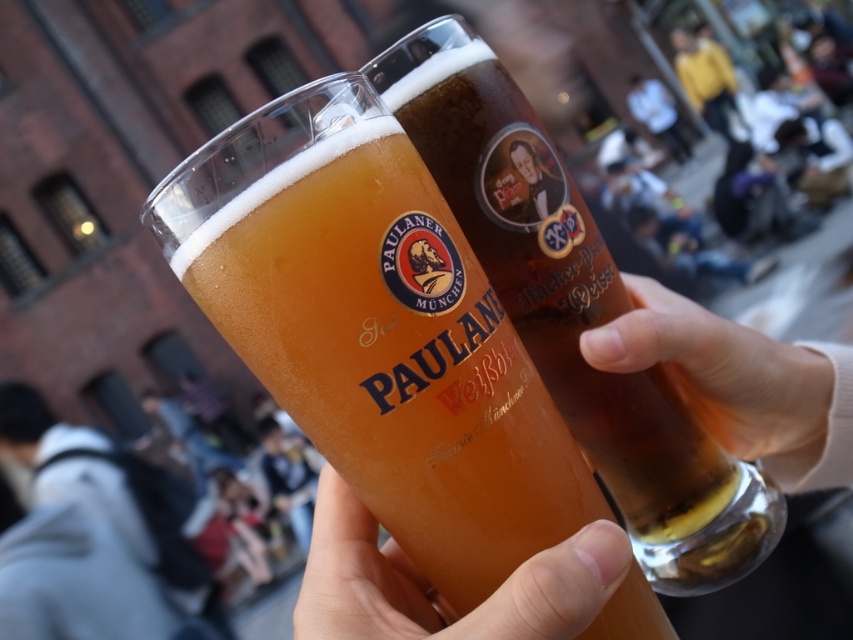
Measure the distance from translucent glass mug at center to pink fabric at lower right.

translucent glass mug at center and pink fabric at lower right are 4.62 centimeters apart from each other.

Can you confirm if translucent glass mug at center is positioned below pink fabric at lower right?

Incorrect, translucent glass mug at center is not positioned below pink fabric at lower right.

Between point (425, 157) and point (766, 397), which one is positioned in front?

Positioned in front is point (425, 157).

The width and height of the screenshot is (853, 640). In order to click on translucent glass mug at center in this screenshot , I will do `click(573, 310)`.

Who is positioned more to the left, translucent glass beer glass at center or translucent glass mug at center?

translucent glass beer glass at center

Does point (491, 532) come in front of point (581, 403)?

Yes.

Where is `translucent glass beer glass at center`? translucent glass beer glass at center is located at coordinates (376, 330).

Is the position of translucent glass at center more distant than that of pink fabric at lower right?

No, translucent glass at center is closer to the viewer.

Who is shorter, translucent glass at center or pink fabric at lower right?

Standing shorter between the two is translucent glass at center.

Is point (379, 611) less distant than point (746, 424)?

Yes, point (379, 611) is in front of point (746, 424).

Identify the location of translucent glass at center. (434, 589).